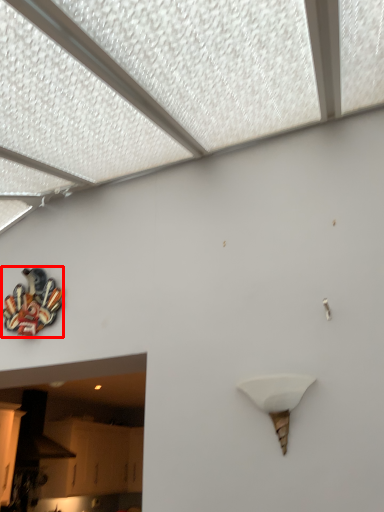
Question: In this image, where is art (annotated by the red box) located relative to lamp?

Choices:
 (A) right
 (B) left

Answer: (B)